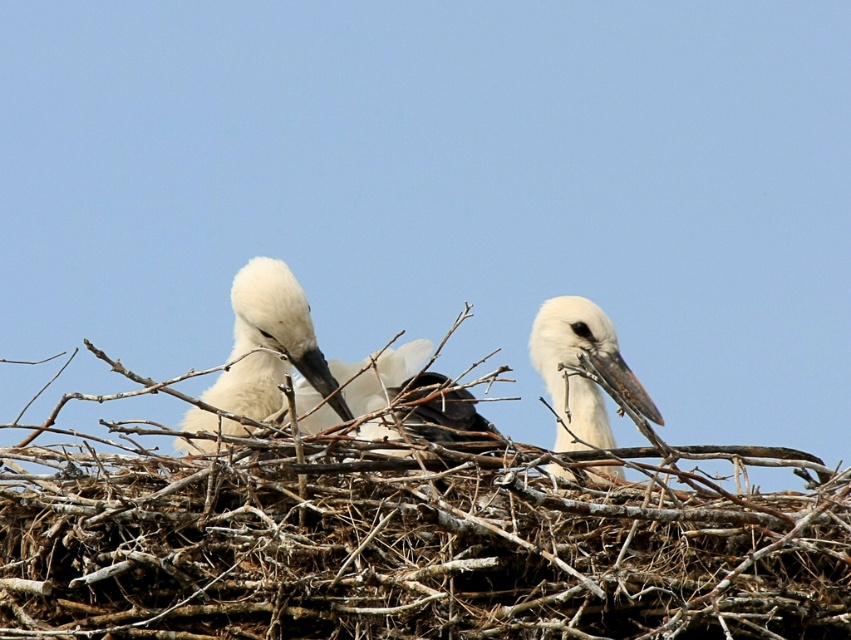
Which of these two, white matte bird at center or white matte stork at right, stands shorter?

With less height is white matte stork at right.

What are the coordinates of `white matte bird at center` in the screenshot? It's located at (267, 342).

Does point (235, 349) come in front of point (607, 330)?

Yes, it is in front of point (607, 330).

At what (x,y) coordinates should I click in order to perform the action: click on white matte bird at center. Please return your answer as a coordinate pair (x, y). Looking at the image, I should click on (267, 342).